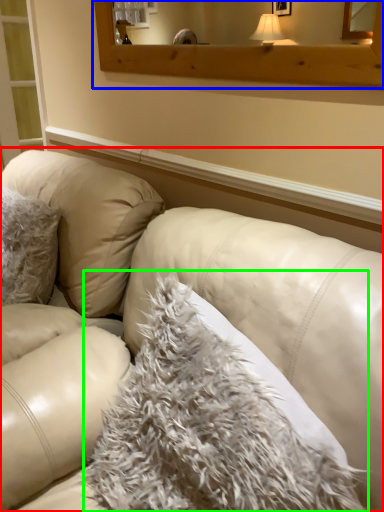
Question: Based on their relative distances, which object is nearer to studio couch (highlighted by a red box)? Choose from window frame (highlighted by a blue box) and blanket (highlighted by a green box).

Choices:
 (A) window frame
 (B) blanket

Answer: (B)